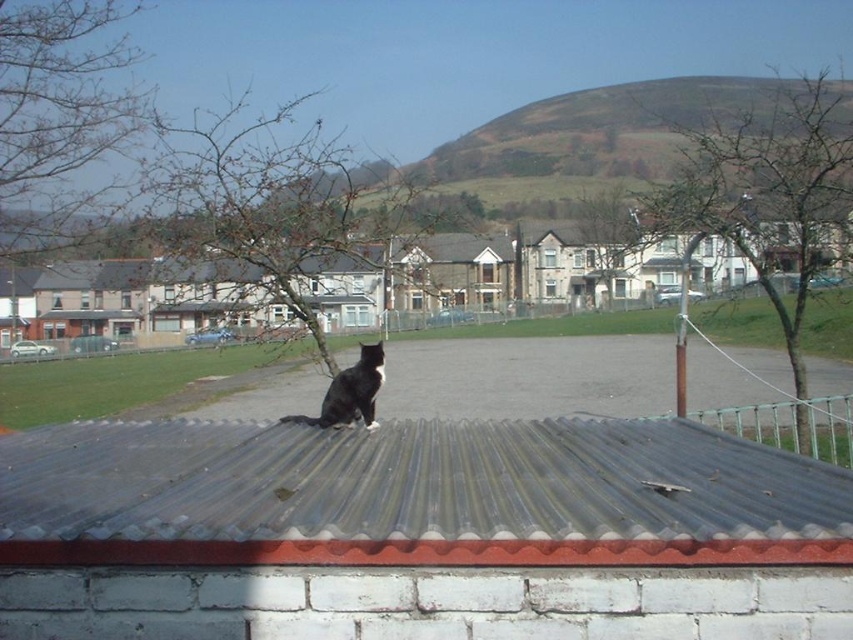
Question: Does bare branches at left appear under green leafy tree at upper center?

Choices:
 (A) yes
 (B) no

Answer: (A)

Question: Estimate the real-world distances between objects in this image. Which object is farther from the metallic corrugated roof at center?

Choices:
 (A) black fur cat at center
 (B) bare branches at center

Answer: (B)

Question: Does metallic corrugated roof at center lie behind black fur cat at center?

Choices:
 (A) no
 (B) yes

Answer: (A)

Question: Is green leafy tree at upper center to the right of black fur cat at center from the viewer's perspective?

Choices:
 (A) no
 (B) yes

Answer: (B)

Question: Which point is closer to the camera taking this photo?

Choices:
 (A) (751, 484)
 (B) (614, 198)
 (C) (357, 404)

Answer: (A)

Question: Which object appears closest to the camera in this image?

Choices:
 (A) metallic corrugated roof at center
 (B) black fur cat at center
 (C) green leafy tree at upper center

Answer: (A)